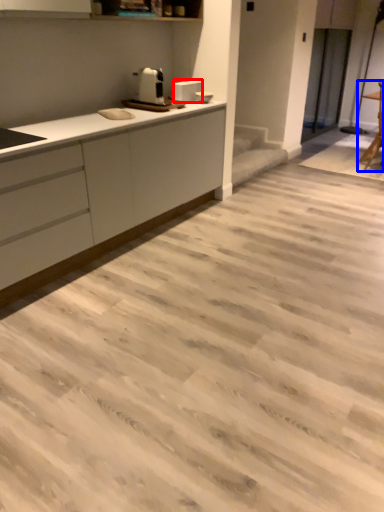
Question: Which point is further to the camera, appliance (highlighted by a red box) or chair (highlighted by a blue box)?

Choices:
 (A) appliance
 (B) chair

Answer: (B)